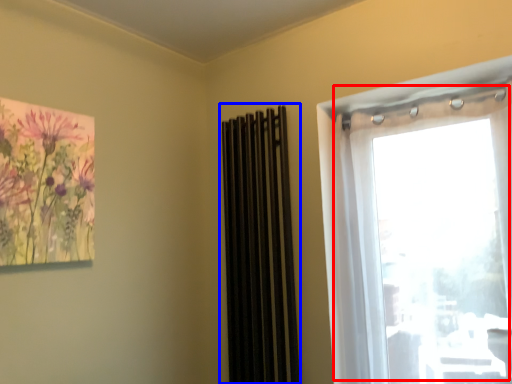
Question: Which object appears closest to the camera in this image, window (highlighted by a red box) or curtain (highlighted by a blue box)?

Choices:
 (A) window
 (B) curtain

Answer: (A)